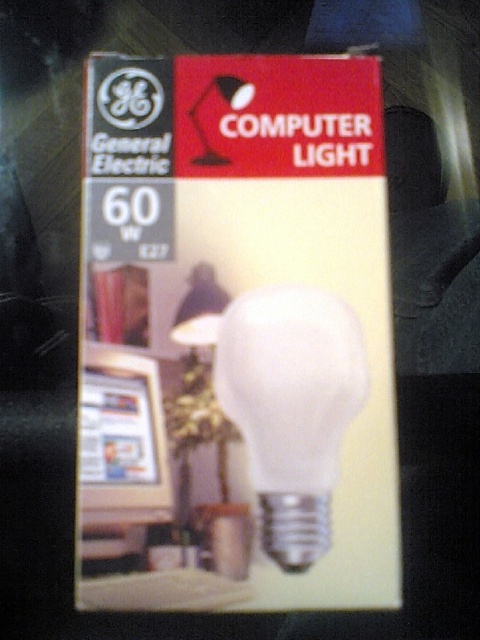
You are a delivery person who just arrived at a customer service center. You need to hand over a package containing a General Electric 60W computer light bulb. The customer service desk is located at point 0.5, 0.5. Where should you place the white matte cardboard box at center to ensure it is as close as possible to the customer service desk?

The white matte cardboard box at center is already positioned at point (236,337), which is very close to the customer service desk at point (240,320). Therefore, you can place it there as it is already near the desired location.

You are designing a promotional poster and need to ensure the white matte cardboard box at center and white matte bulb at center are spaced appropriately. According to the packaging dimensions, what is the minimum distance you should leave between them?

The minimum distance you should leave between the white matte cardboard box at center and the white matte bulb at center is 1.98 inches, as that is the distance between them on the packaging.

You are standing in front of the packaging for a General Electric 60W computer light bulb. There is a point marked at coordinates (x=236, y=337). Which object on the packaging is located at this point?

The white matte cardboard box at center is located at point (x=236, y=337).